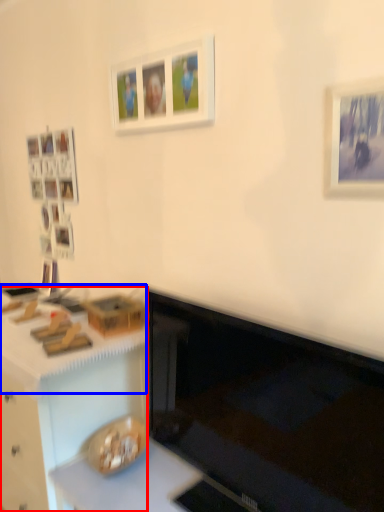
Question: Among these objects, which one is nearest to the camera, desk (highlighted by a red box) or counter top (highlighted by a blue box)?

Choices:
 (A) desk
 (B) counter top

Answer: (B)